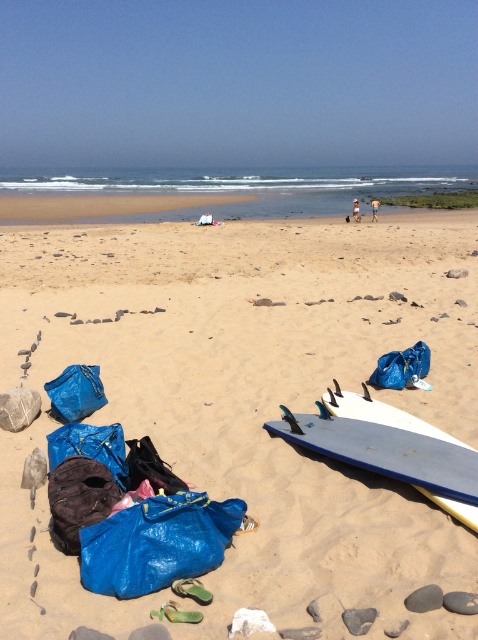
Question: Does smooth sand at center have a smaller size compared to blue matte surfboard at lower center?

Choices:
 (A) yes
 (B) no

Answer: (B)

Question: Which of these objects is positioned farthest from the blue fabric bag at lower left?

Choices:
 (A) smooth sand at center
 (B) blue fabric bag at lower right

Answer: (B)

Question: Can you confirm if blue matte surfboard at lower center is bigger than dark brown fabric bag at lower left?

Choices:
 (A) no
 (B) yes

Answer: (B)

Question: Estimate the real-world distances between objects in this image. Which object is closer to the smooth sand at center?

Choices:
 (A) dark brown fabric bag at lower left
 (B) blue fabric bag at lower left
 (C) blue fabric bag at lower right
 (D) blue tarp at lower left

Answer: (D)

Question: Which of the following is the closest to the observer?

Choices:
 (A) blue tarp at lower left
 (B) smooth sand at center
 (C) dark brown fabric bag at lower left

Answer: (B)

Question: Is dark brown fabric bag at lower left thinner than blue fabric bag at lower left?

Choices:
 (A) yes
 (B) no

Answer: (A)